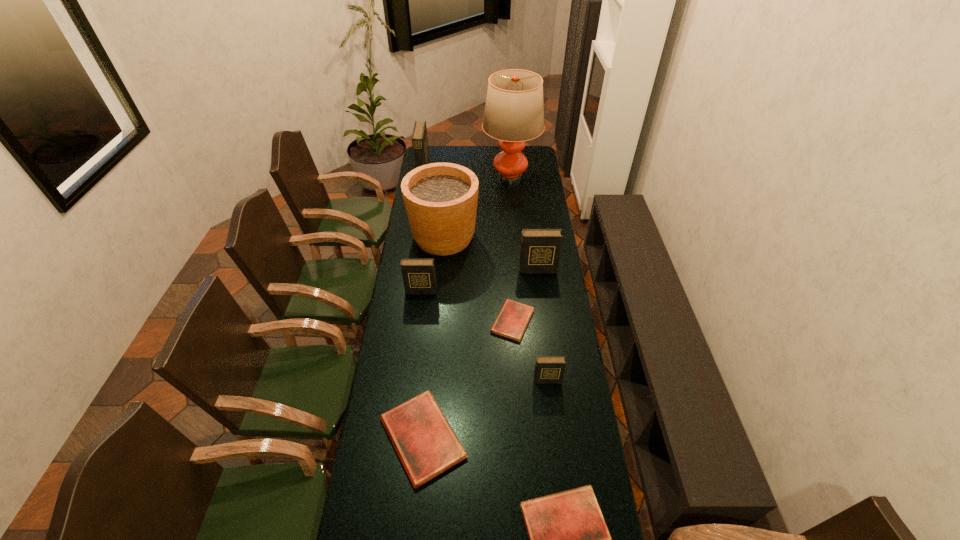
What are the coordinates of `orange lamp` in the screenshot? It's located at (514, 112).

Find the location of a particular element. This screenshot has height=540, width=960. lamp is located at coordinates (514, 112).

Locate an element on the screen. the third farthest object is located at coordinates (440, 199).

Where is `the farthest dark diary`? The width and height of the screenshot is (960, 540). the farthest dark diary is located at coordinates (419, 137).

The height and width of the screenshot is (540, 960). What are the coordinates of `the tallest diary` in the screenshot? It's located at (419, 137).

You are a GUI agent. You are given a task and a screenshot of the screen. Output one action in this format:
    pyautogui.click(x=<x>, y=<y>)
    Task: Click on the fourth tallest object
    
    Given the screenshot: What is the action you would take?
    pyautogui.click(x=540, y=251)

The image size is (960, 540). I want to click on the second farthest diary, so 540,251.

Locate an element on the screen. The height and width of the screenshot is (540, 960). the fifth shortest object is located at coordinates (419, 276).

You are a GUI agent. You are given a task and a screenshot of the screen. Output one action in this format:
    pyautogui.click(x=<x>, y=<y>)
    Task: Click on the fifth shortest diary
    
    Given the screenshot: What is the action you would take?
    pyautogui.click(x=419, y=276)

Identify the location of the fifth farthest diary. Image resolution: width=960 pixels, height=540 pixels. (548, 369).